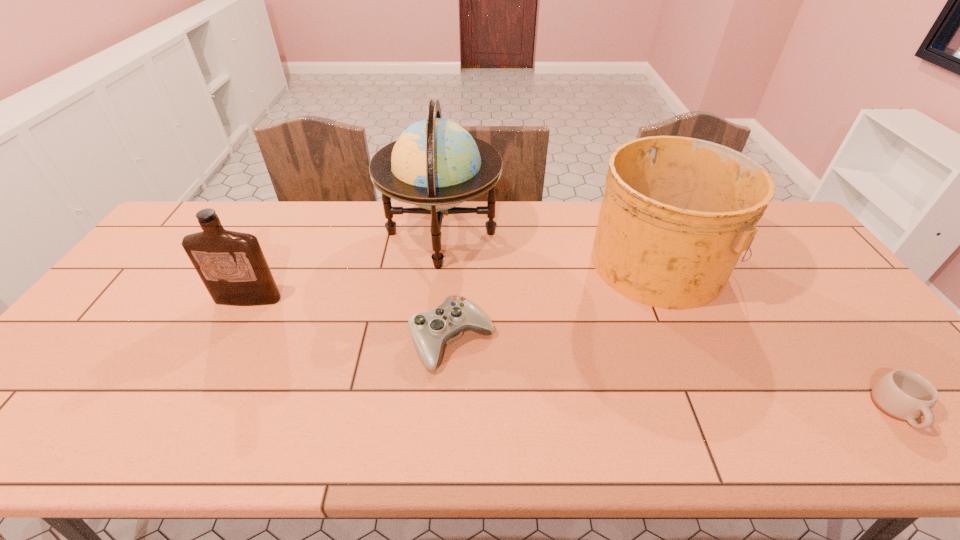
The image size is (960, 540). I want to click on vacant space in between the nearest object and the bucket, so click(778, 335).

Find the location of a particular element. The height and width of the screenshot is (540, 960). vacant area that lies between the bucket and the liquor is located at coordinates (453, 280).

This screenshot has height=540, width=960. What are the coordinates of `free area in between the fourth object from left to right and the globe` in the screenshot? It's located at (550, 247).

Locate an element on the screen. The width and height of the screenshot is (960, 540). free space that is in between the rightmost object and the leftmost object is located at coordinates (573, 354).

Locate an element on the screen. This screenshot has height=540, width=960. vacant area between the globe and the liquor is located at coordinates (345, 266).

The image size is (960, 540). Identify the location of empty space that is in between the shortest object and the bucket. (778, 335).

This screenshot has width=960, height=540. In order to click on vacant space in between the leftmost object and the control in this screenshot , I will do `click(350, 320)`.

What are the coordinates of `vacant area that lies between the shortest object and the tallest object` in the screenshot? It's located at (669, 321).

Find the location of `free space between the rightmost object and the second object from right to left`. free space between the rightmost object and the second object from right to left is located at coordinates (778, 335).

Identify which object is located as the third nearest to the globe. Please provide its 2D coordinates. Your answer should be formatted as a tuple, i.e. [(x, y)], where the tuple contains the x and y coordinates of a point satisfying the conditions above.

[(677, 213)]